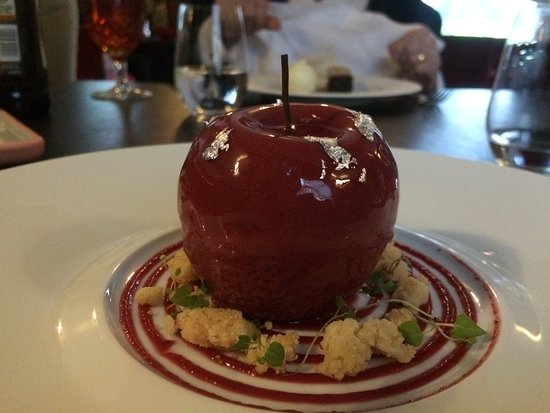
Identify the location of white plate. (59, 349).